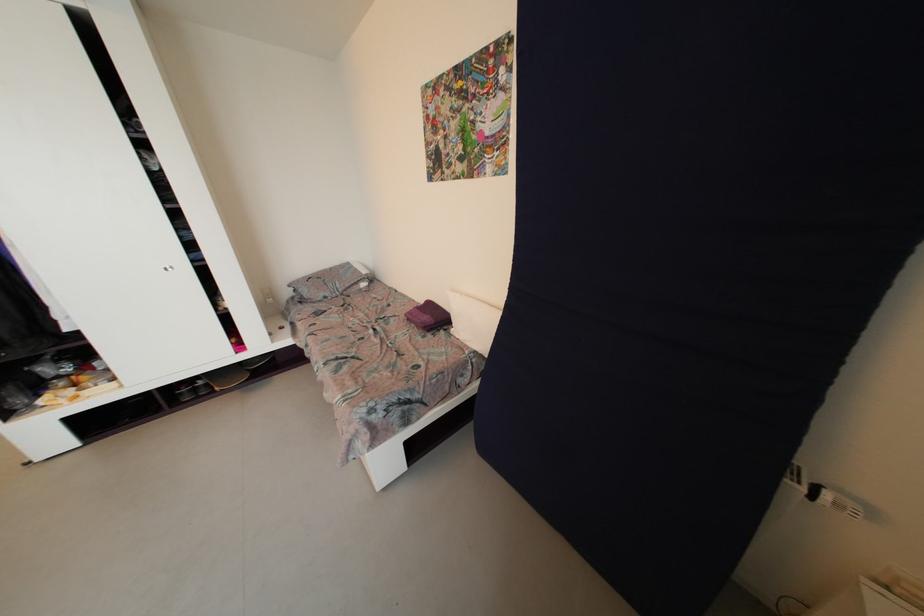
Find where to unfold the purple folded towel. Please return your answer as a coordinate pair (x, y).

(429, 315)